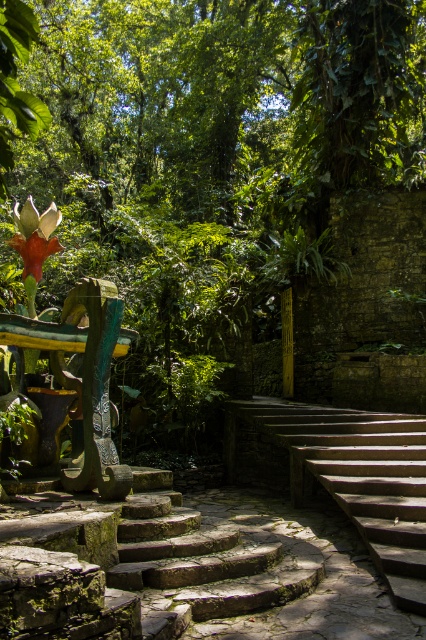
Is green mossy stone stairs at center further to the viewer compared to stone textured stairs at center?

That is False.

Is point (255, 538) behind point (307, 481)?

No, (255, 538) is in front of (307, 481).

Locate an element on the screen. The width and height of the screenshot is (426, 640). green mossy stone stairs at center is located at coordinates (135, 564).

The image size is (426, 640). What do you see at coordinates (345, 474) in the screenshot?
I see `stone textured stairs at center` at bounding box center [345, 474].

Which is below, stone textured stairs at center or orange matte flower at left?

stone textured stairs at center is below.

Between point (377, 449) and point (34, 272), which one is positioned behind?

Point (377, 449)

Where is `stone textured stairs at center`? The width and height of the screenshot is (426, 640). stone textured stairs at center is located at coordinates (345, 474).

Which is in front, point (37, 528) or point (13, 241)?

Point (37, 528)

Between green mossy stone stairs at center and orange matte flower at left, which one is positioned lower?

green mossy stone stairs at center

Locate an element on the screen. The height and width of the screenshot is (640, 426). green mossy stone stairs at center is located at coordinates (135, 564).

The width and height of the screenshot is (426, 640). I want to click on green mossy stone stairs at center, so click(135, 564).